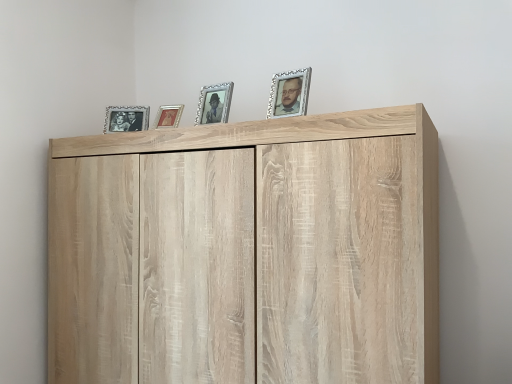
Question: Considering the relative sizes of matte silver picture frame at upper left, which is the 1th picture frame in left-to-right order, and silver/glass picture frame at upper right, the 4th picture frame when ordered from back to front, in the image provided, is matte silver picture frame at upper left, which is the 1th picture frame in left-to-right order, smaller than silver/glass picture frame at upper right, the 4th picture frame when ordered from back to front,?

Choices:
 (A) yes
 (B) no

Answer: (B)

Question: From a real-world perspective, does matte silver picture frame at upper left, which is the 1th picture frame in left-to-right order, stand above silver/glass picture frame at upper right, placed as the 4th picture frame when sorted from left to right?

Choices:
 (A) yes
 (B) no

Answer: (B)

Question: From the image's perspective, is matte silver picture frame at upper left, which is the 1th picture frame from back to front, located beneath silver/glass picture frame at upper right, placed as the 4th picture frame when sorted from left to right?

Choices:
 (A) no
 (B) yes

Answer: (B)

Question: Is the position of matte silver picture frame at upper left, which ranks as the fourth picture frame in right-to-left order, more distant than that of silver/glass picture frame at upper right, the first picture frame in the right-to-left sequence?

Choices:
 (A) no
 (B) yes

Answer: (B)

Question: From the image's perspective, does matte silver picture frame at upper left, which ranks as the fourth picture frame in right-to-left order, appear higher than silver/glass picture frame at upper right, the first picture frame in the right-to-left sequence?

Choices:
 (A) no
 (B) yes

Answer: (A)

Question: Is silver/glass picture frame at upper right, the first picture frame in the right-to-left sequence, inside or outside of silver/glass picture frame at center, the second picture frame from the right?

Choices:
 (A) inside
 (B) outside

Answer: (B)

Question: From their relative heights in the image, would you say silver/glass picture frame at upper right, the 4th picture frame when ordered from back to front, is taller or shorter than silver/glass picture frame at center, placed as the 2th picture frame when sorted from front to back?

Choices:
 (A) tall
 (B) short

Answer: (B)

Question: Is silver/glass picture frame at upper right, placed as the 4th picture frame when sorted from left to right, in front of or behind silver/glass picture frame at center, acting as the third picture frame starting from the back, in the image?

Choices:
 (A) front
 (B) behind

Answer: (A)

Question: From the image's perspective, is silver/glass picture frame at upper right, placed as the 4th picture frame when sorted from left to right, above or below silver/glass picture frame at center, acting as the third picture frame starting from the back?

Choices:
 (A) above
 (B) below

Answer: (A)

Question: Is point (159, 127) closer or farther from the camera than point (122, 261)?

Choices:
 (A) farther
 (B) closer

Answer: (A)

Question: Choose the correct answer: Is metallic gold picture frame at center, the third picture frame viewed from the right, inside light wood cupboard at upper center or outside it?

Choices:
 (A) inside
 (B) outside

Answer: (B)

Question: From the image's perspective, is metallic gold picture frame at center, the third picture frame viewed from the right, located above or below light wood cupboard at upper center?

Choices:
 (A) below
 (B) above

Answer: (B)

Question: Looking at their shapes, would you say metallic gold picture frame at center, the 3th picture frame viewed from the front, is wider or thinner than light wood cupboard at upper center?

Choices:
 (A) wide
 (B) thin

Answer: (B)

Question: In the image, is silver/glass picture frame at center, the third picture frame in the left-to-right sequence, positioned in front of or behind matte silver picture frame at upper left, which is the 1th picture frame in left-to-right order?

Choices:
 (A) front
 (B) behind

Answer: (A)

Question: In terms of height, does silver/glass picture frame at center, the second picture frame from the right, look taller or shorter compared to matte silver picture frame at upper left, which is the 1th picture frame in left-to-right order?

Choices:
 (A) tall
 (B) short

Answer: (A)